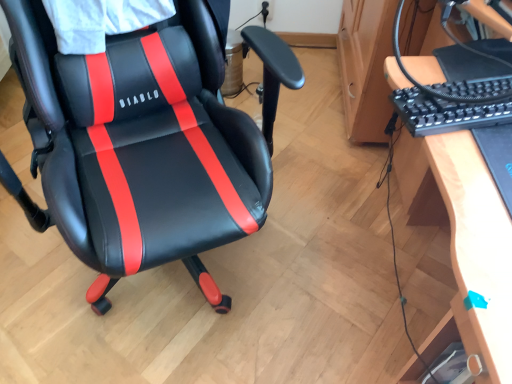
Question: Is black plastic keyboard at right bigger than black leather chair at center?

Choices:
 (A) no
 (B) yes

Answer: (A)

Question: Considering the relative sizes of black plastic keyboard at right and black leather chair at center in the image provided, is black plastic keyboard at right thinner than black leather chair at center?

Choices:
 (A) no
 (B) yes

Answer: (B)

Question: From a real-world perspective, is black plastic keyboard at right positioned over black leather chair at center based on gravity?

Choices:
 (A) no
 (B) yes

Answer: (B)

Question: From the image's perspective, would you say black plastic keyboard at right is positioned over black leather chair at center?

Choices:
 (A) no
 (B) yes

Answer: (B)

Question: Can you confirm if black plastic keyboard at right is positioned to the right of black leather chair at center?

Choices:
 (A) no
 (B) yes

Answer: (B)

Question: Is black plastic keyboard at right completely or partially outside of black leather chair at center?

Choices:
 (A) no
 (B) yes

Answer: (B)

Question: Is black leather chair at center smaller than black plastic keyboard at right?

Choices:
 (A) yes
 (B) no

Answer: (B)

Question: Considering the relative sizes of black leather chair at center and black plastic keyboard at right in the image provided, is black leather chair at center shorter than black plastic keyboard at right?

Choices:
 (A) yes
 (B) no

Answer: (B)

Question: Does black leather chair at center turn towards black plastic keyboard at right?

Choices:
 (A) yes
 (B) no

Answer: (B)

Question: Is black leather chair at center located outside black plastic keyboard at right?

Choices:
 (A) no
 (B) yes

Answer: (B)

Question: Is the depth of black leather chair at center less than that of black plastic keyboard at right?

Choices:
 (A) yes
 (B) no

Answer: (A)

Question: From the image's perspective, does black leather chair at center appear higher than black plastic keyboard at right?

Choices:
 (A) yes
 (B) no

Answer: (B)

Question: Are wooden desk at right and black leather chair at center beside each other?

Choices:
 (A) yes
 (B) no

Answer: (B)